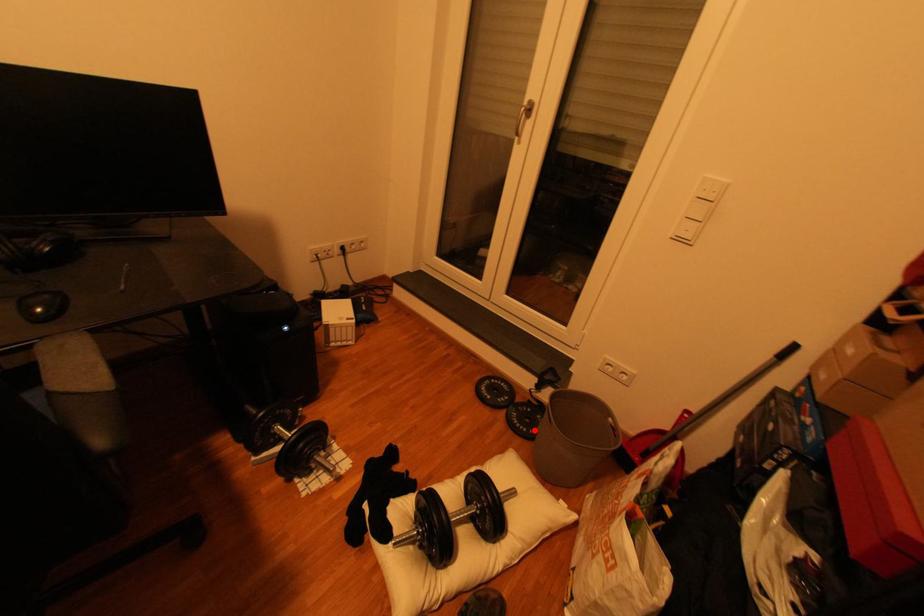
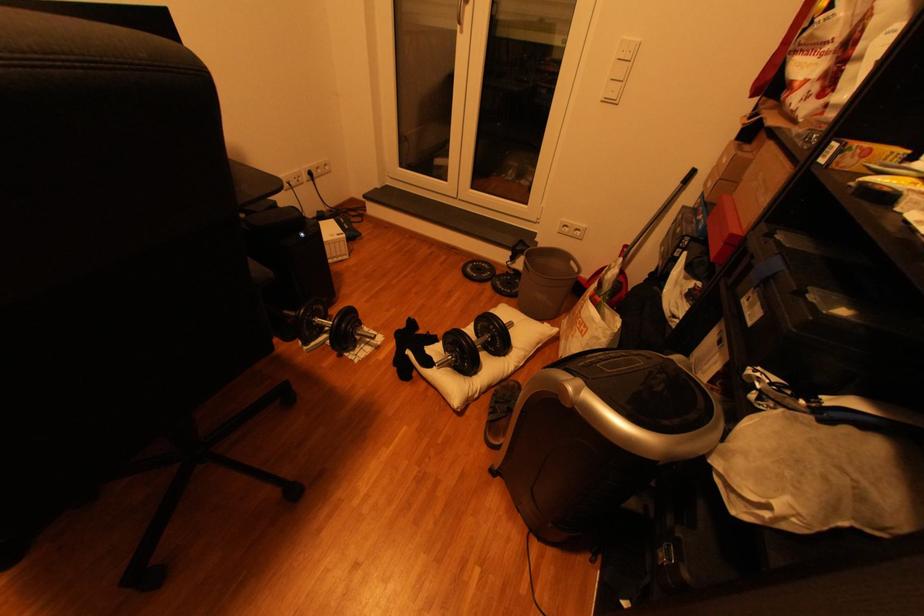
Question: I am providing you with two images of the same scene from different viewpoints. A red point is marked on the first image. Is the red point's position out of view in image 2?

Choices:
 (A) Yes
 (B) No

Answer: (B)